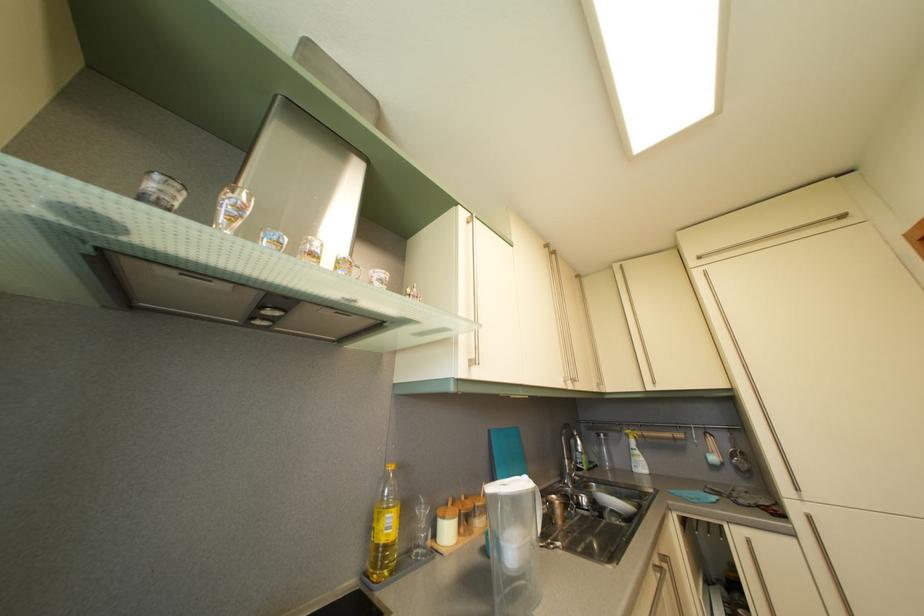
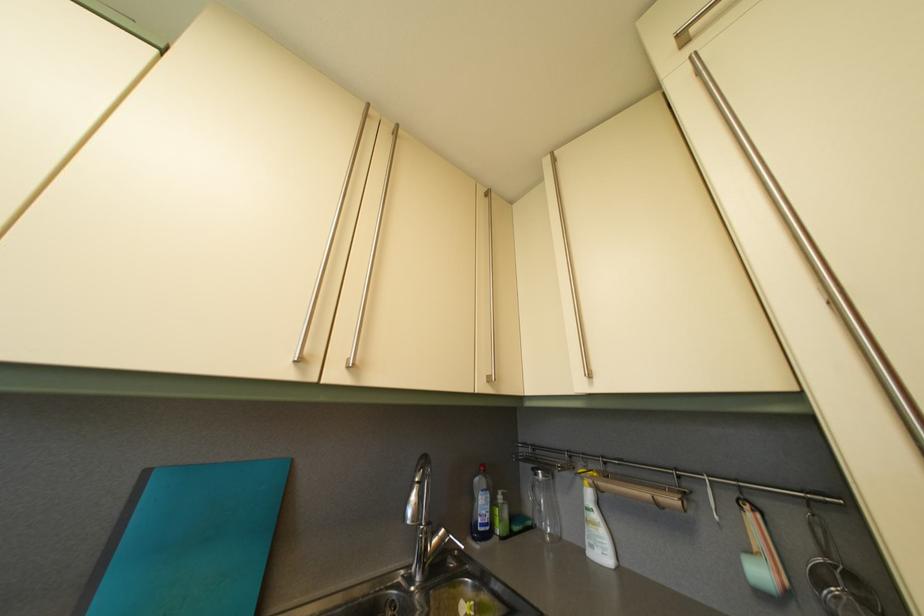
In the second image, find the point that corresponds to [608,444] in the first image.

(544, 482)